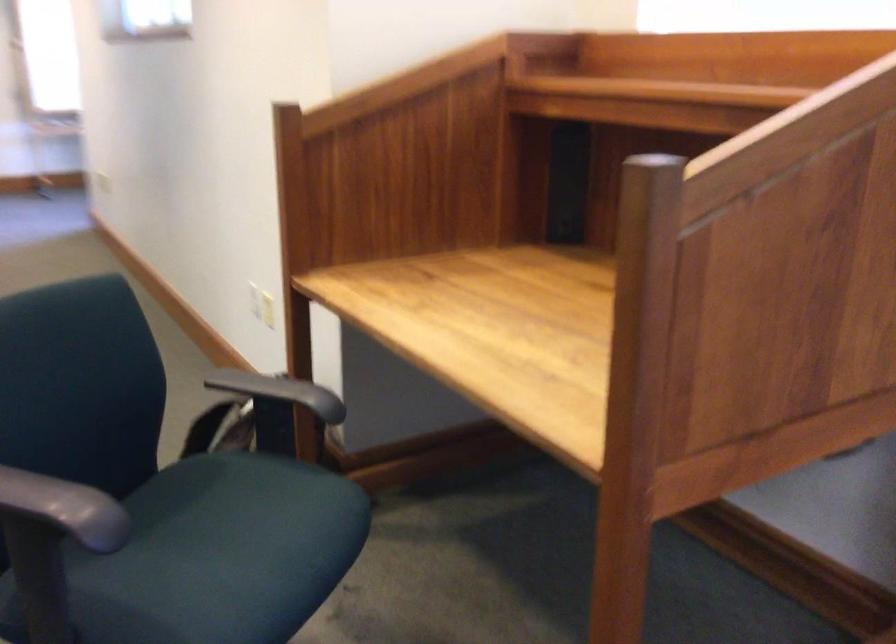
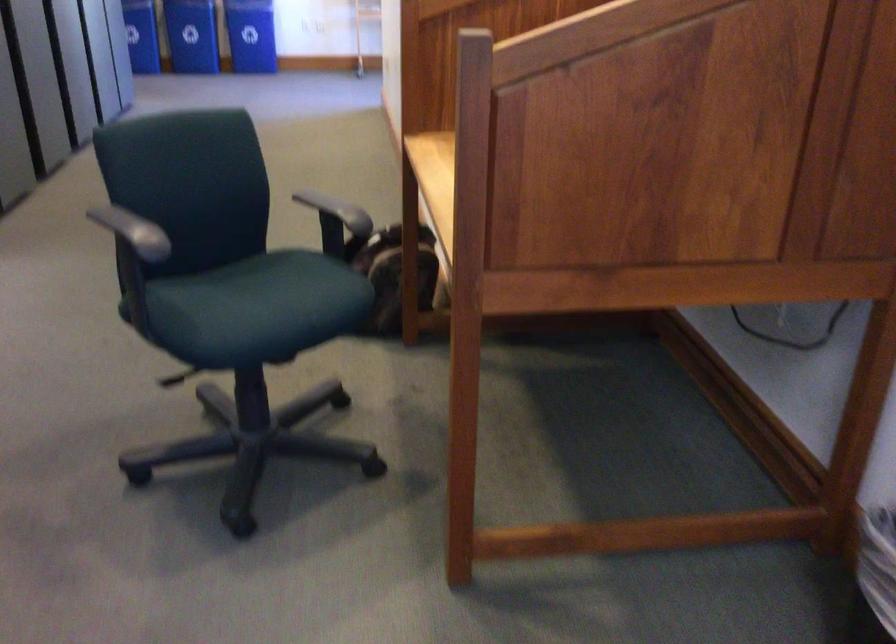
In the second image, find the point that corresponds to pixel 255 534 in the first image.

(277, 295)